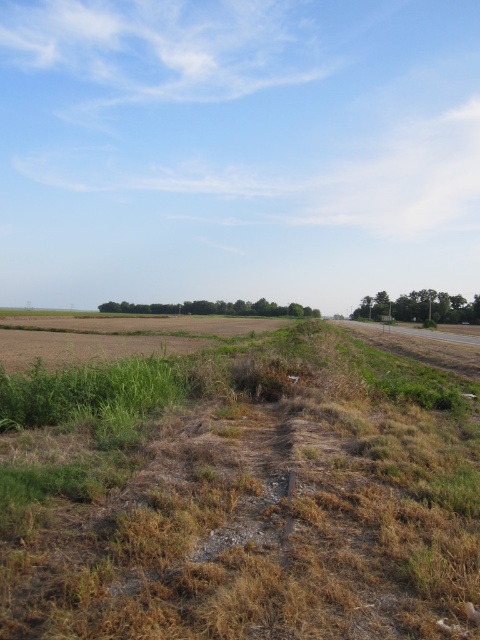
Between point (213, 429) and point (7, 353), which one is positioned in front?

Positioned in front is point (213, 429).

Is brown dry grass at lower left to the right of brown grassy dirt field at lower left from the viewer's perspective?

Indeed, brown dry grass at lower left is positioned on the right side of brown grassy dirt field at lower left.

Who is more distant from viewer, (215, 621) or (207, 332)?

Point (207, 332)

Locate an element on the screen. This screenshot has width=480, height=640. brown dry grass at lower left is located at coordinates (240, 493).